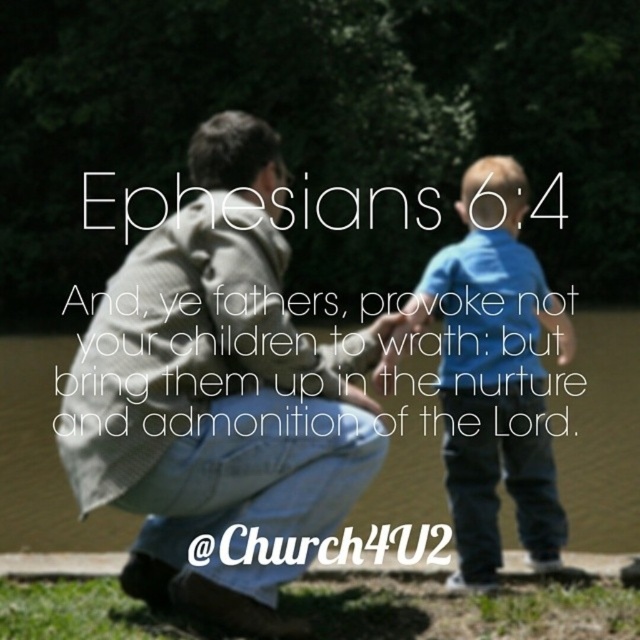
Which is more to the left, clear water at lower left or blue cotton shirt at center?

blue cotton shirt at center is more to the left.

Which is behind, point (604, 326) or point (540, 371)?

Point (604, 326)

This screenshot has width=640, height=640. In order to click on clear water at lower left in this screenshot , I will do `click(602, 433)`.

The width and height of the screenshot is (640, 640). Describe the element at coordinates (218, 396) in the screenshot. I see `light blue denim jeans at center` at that location.

Can you confirm if light blue denim jeans at center is positioned to the left of blue cotton shirt at center?

Correct, you'll find light blue denim jeans at center to the left of blue cotton shirt at center.

Between point (376, 413) and point (474, 529), which one is positioned in front?

Point (376, 413)

Find the location of a particular element. light blue denim jeans at center is located at coordinates (218, 396).

Does light blue denim jeans at center have a greater height compared to clear water at lower left?

In fact, light blue denim jeans at center may be shorter than clear water at lower left.

Who is more distant from viewer, (285, 262) or (321, 332)?

Point (321, 332)

Identify the location of light blue denim jeans at center. (218, 396).